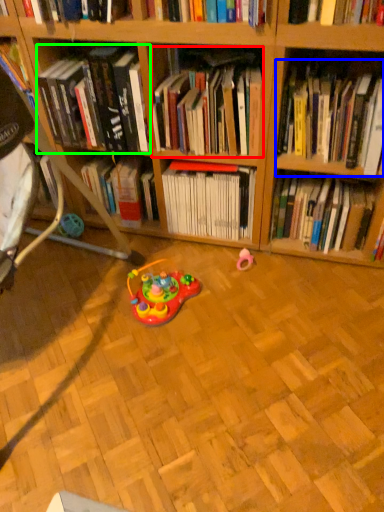
Question: Considering the real-world distances, which object is closest to book (highlighted by a red box)? book (highlighted by a blue box) or book (highlighted by a green box).

Choices:
 (A) book
 (B) book

Answer: (B)